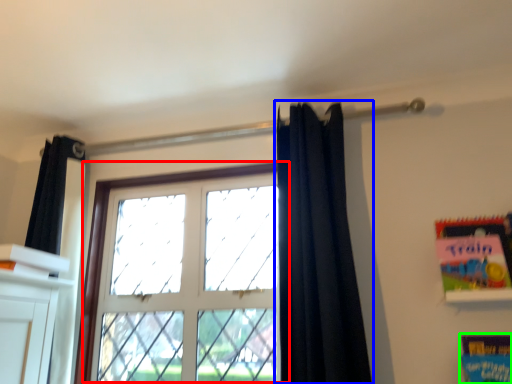
Question: Which is nearer to the window (highlighted by a red box)? curtain (highlighted by a blue box) or paperback book (highlighted by a green box).

Choices:
 (A) curtain
 (B) paperback book

Answer: (A)